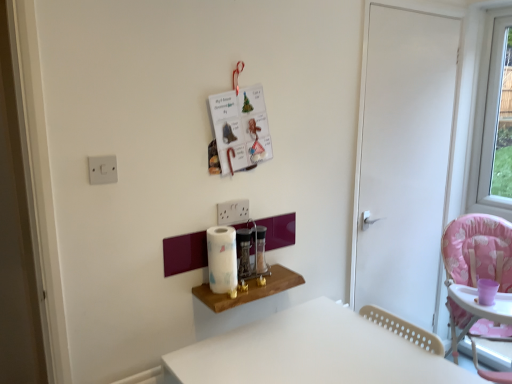
Question: Is pink fabric highchair at right taller or shorter than metallic glass spice jar at center, the 2th appliance from the right?

Choices:
 (A) short
 (B) tall

Answer: (B)

Question: Is pink fabric highchair at right wider or thinner than metallic glass spice jar at center, the 2th appliance from the right?

Choices:
 (A) wide
 (B) thin

Answer: (A)

Question: Based on their relative distances, which object is nearer to the transparent glass window at upper right?

Choices:
 (A) translucent glass spice jar at center, positioned as the 1th appliance in right-to-left order
 (B) pink fabric highchair at right
 (C) white matte door at right
 (D) metallic glass spice jar at center, the 2th appliance from the right
 (E) white matte table at lower center, which appears as the first table when viewed from the right

Answer: (C)

Question: Which is nearer to the wooden shelf at center, the 1th table positioned from the top?

Choices:
 (A) white matte table at lower center, which ranks as the second table in top-to-bottom order
 (B) metallic glass spice jar at center, arranged as the first appliance when viewed from the left
 (C) white plastic electric outlet at upper left
 (D) pink fabric highchair at right
 (E) transparent glass window at upper right

Answer: (B)